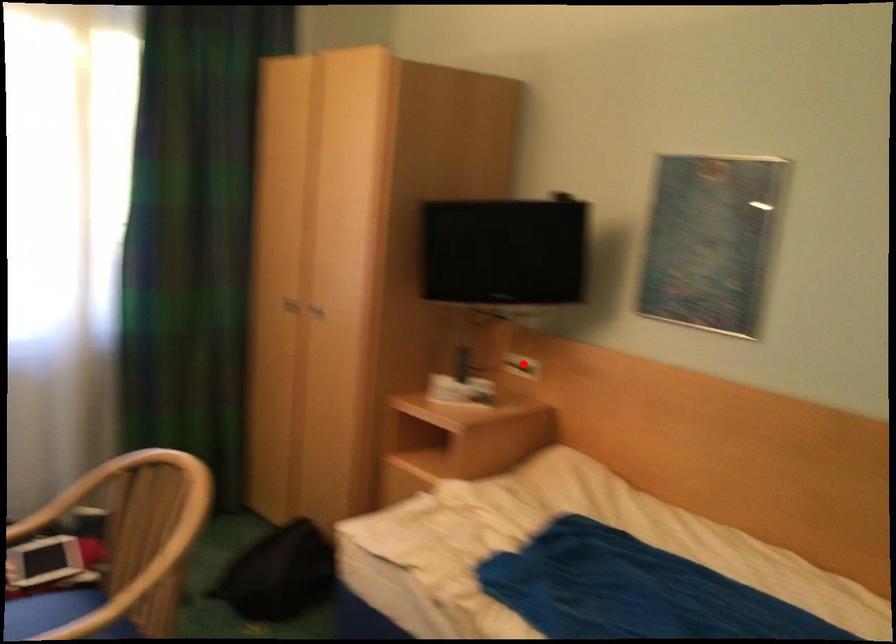
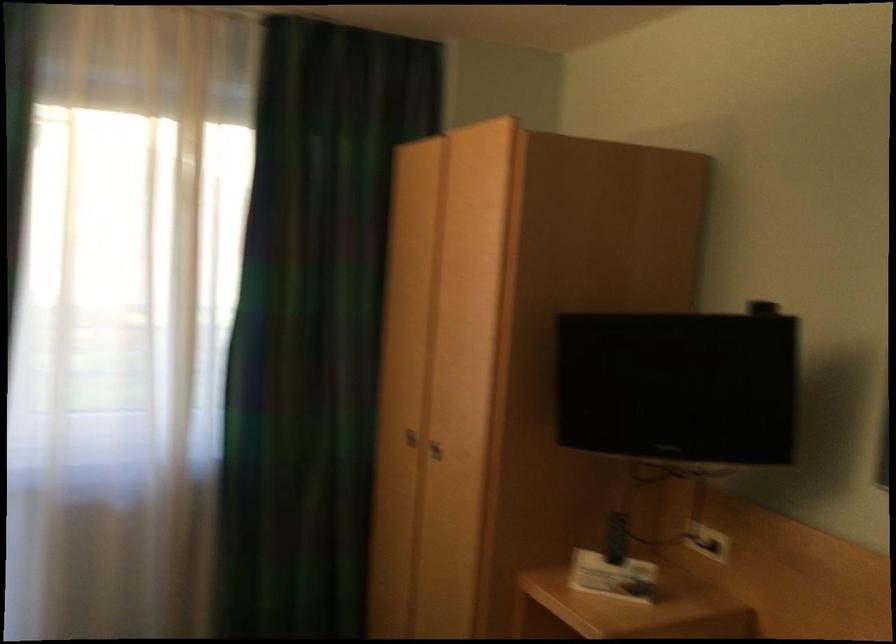
The point at the highlighted location is marked in the first image. Where is the corresponding point in the second image?

(707, 542)